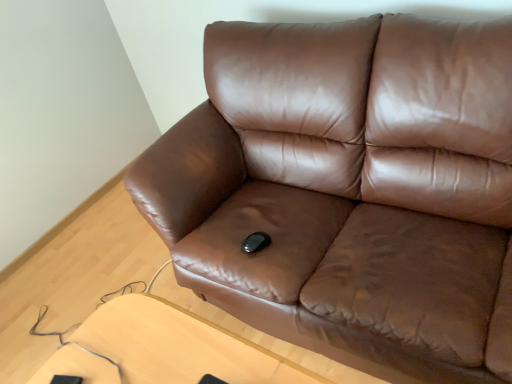
Question: Relative to brown leather couch at center, is light brown wooden table at lower center in front or behind?

Choices:
 (A) front
 (B) behind

Answer: (B)

Question: Looking at their shapes, would you say light brown wooden table at lower center is wider or thinner than brown leather couch at center?

Choices:
 (A) thin
 (B) wide

Answer: (A)

Question: In the image, is light brown wooden table at lower center on the left side or the right side of brown leather couch at center?

Choices:
 (A) left
 (B) right

Answer: (A)

Question: Looking at the image, does brown leather couch at center seem bigger or smaller compared to light brown wooden table at lower center?

Choices:
 (A) small
 (B) big

Answer: (B)

Question: From the image's perspective, is brown leather couch at center positioned above or below light brown wooden table at lower center?

Choices:
 (A) below
 (B) above

Answer: (B)

Question: Is brown leather couch at center in front of or behind light brown wooden table at lower center in the image?

Choices:
 (A) behind
 (B) front

Answer: (B)

Question: Is brown leather couch at center taller or shorter than light brown wooden table at lower center?

Choices:
 (A) tall
 (B) short

Answer: (A)